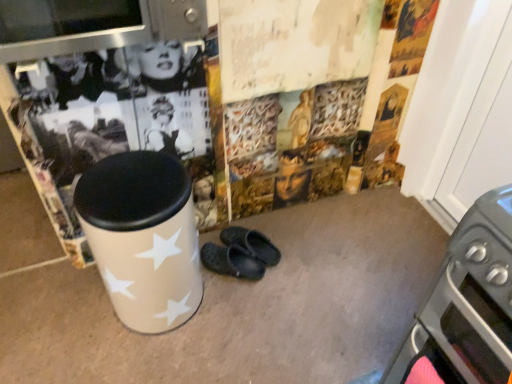
Question: Is the surface of white glossy trash can at center in direct contact with metallic stainless steel microwave at upper left?

Choices:
 (A) yes
 (B) no

Answer: (B)

Question: Is white glossy trash can at center completely or partially outside of metallic stainless steel microwave at upper left?

Choices:
 (A) yes
 (B) no

Answer: (A)

Question: Considering the relative sizes of white glossy trash can at center and metallic stainless steel microwave at upper left in the image provided, is white glossy trash can at center bigger than metallic stainless steel microwave at upper left?

Choices:
 (A) no
 (B) yes

Answer: (B)

Question: Does white glossy trash can at center contain metallic stainless steel microwave at upper left?

Choices:
 (A) yes
 (B) no

Answer: (B)

Question: Considering the relative sizes of white glossy trash can at center and metallic stainless steel microwave at upper left in the image provided, is white glossy trash can at center smaller than metallic stainless steel microwave at upper left?

Choices:
 (A) no
 (B) yes

Answer: (A)

Question: Does white glossy trash can at center have a greater width compared to metallic stainless steel microwave at upper left?

Choices:
 (A) no
 (B) yes

Answer: (A)

Question: Can you confirm if white glossy trash can at center is positioned to the left of metallic gray oven at lower right?

Choices:
 (A) yes
 (B) no

Answer: (A)

Question: Could you tell me if white glossy trash can at center is turned towards metallic gray oven at lower right?

Choices:
 (A) yes
 (B) no

Answer: (B)

Question: Does white glossy trash can at center touch metallic gray oven at lower right?

Choices:
 (A) yes
 (B) no

Answer: (B)

Question: Is the position of white glossy trash can at center more distant than that of metallic gray oven at lower right?

Choices:
 (A) yes
 (B) no

Answer: (A)

Question: Is white glossy trash can at center wider than metallic gray oven at lower right?

Choices:
 (A) yes
 (B) no

Answer: (B)

Question: Can you confirm if white glossy trash can at center is shorter than metallic gray oven at lower right?

Choices:
 (A) no
 (B) yes

Answer: (B)

Question: From a real-world perspective, does metallic stainless steel microwave at upper left stand above white glossy trash can at center?

Choices:
 (A) yes
 (B) no

Answer: (A)